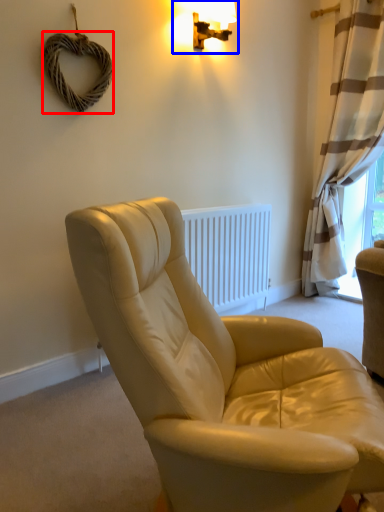
Question: Which object appears closest to the camera in this image, rope (highlighted by a red box) or lamp (highlighted by a blue box)?

Choices:
 (A) rope
 (B) lamp

Answer: (A)